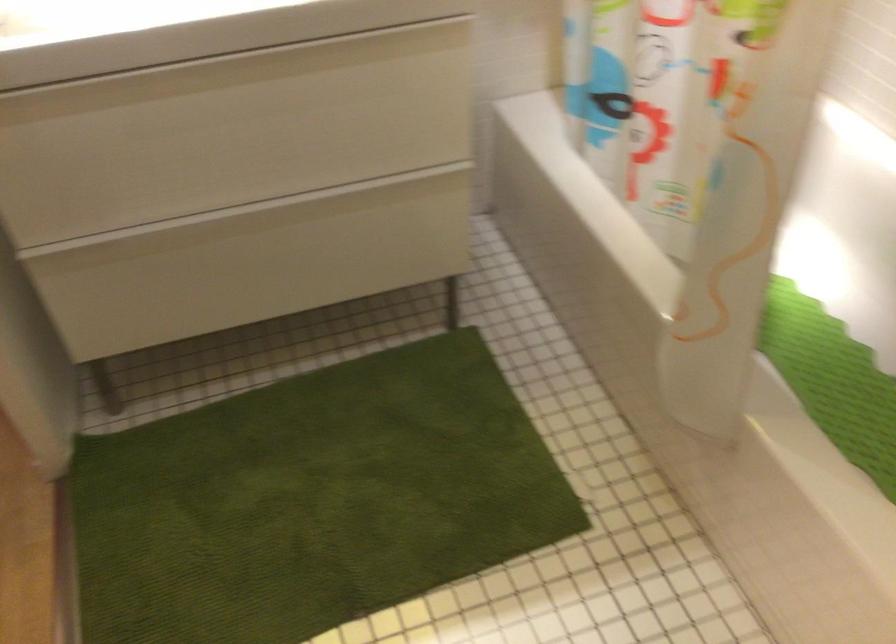
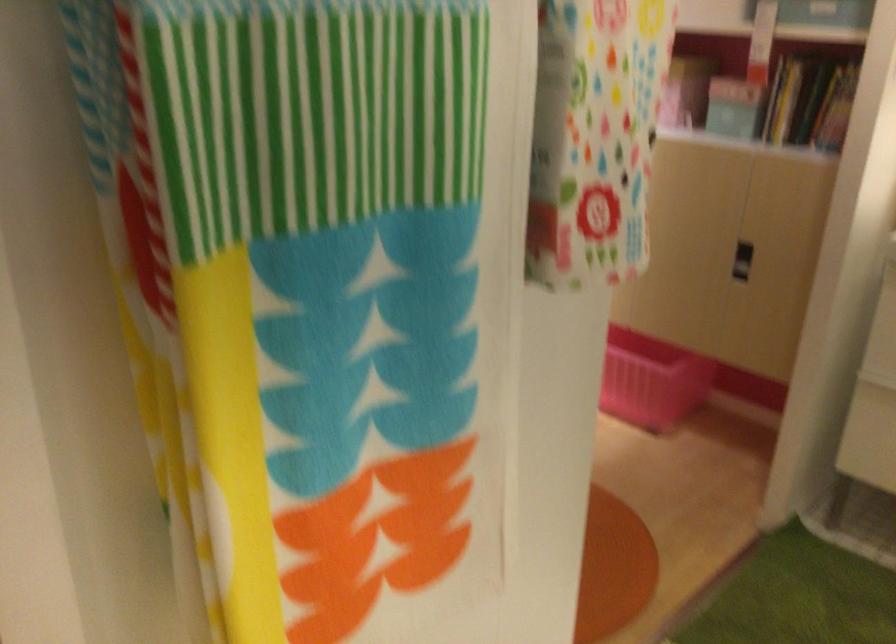
Question: The first image is from the beginning of the video and the second image is from the end. How did the camera likely rotate when shooting the video?

Choices:
 (A) Left
 (B) Right
 (C) Up
 (D) Down

Answer: (A)